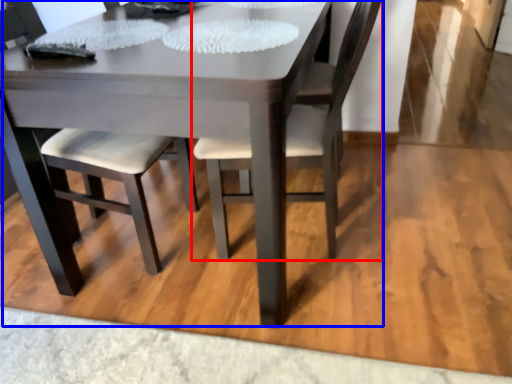
Question: Among these objects, which one is farthest to the camera, chair (highlighted by a red box) or kitchen & dining room table (highlighted by a blue box)?

Choices:
 (A) chair
 (B) kitchen & dining room table

Answer: (A)